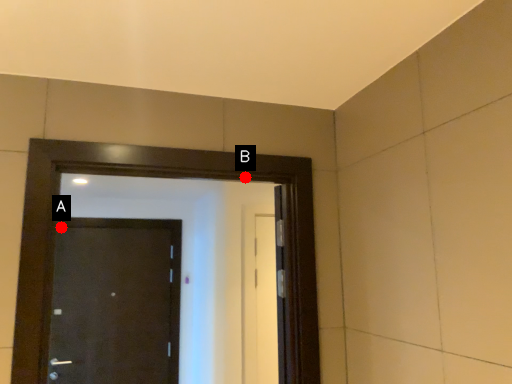
Question: Two points are circled on the image, labeled by A and B beside each circle. Among these points, which one is nearest to the camera?

Choices:
 (A) A is closer
 (B) B is closer

Answer: (B)